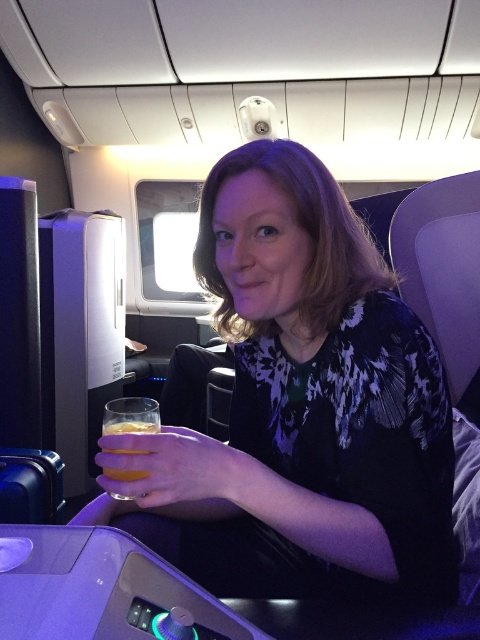
Is matte black dress at center smaller than translucent glass at lower left?

Actually, matte black dress at center might be larger than translucent glass at lower left.

Can you confirm if matte black dress at center is positioned to the left of translucent glass at lower left?

Incorrect, matte black dress at center is not on the left side of translucent glass at lower left.

Between point (192, 435) and point (128, 416), which one is positioned behind?

The point (128, 416) is behind.

In order to click on matte black dress at center in this screenshot , I will do `click(301, 406)`.